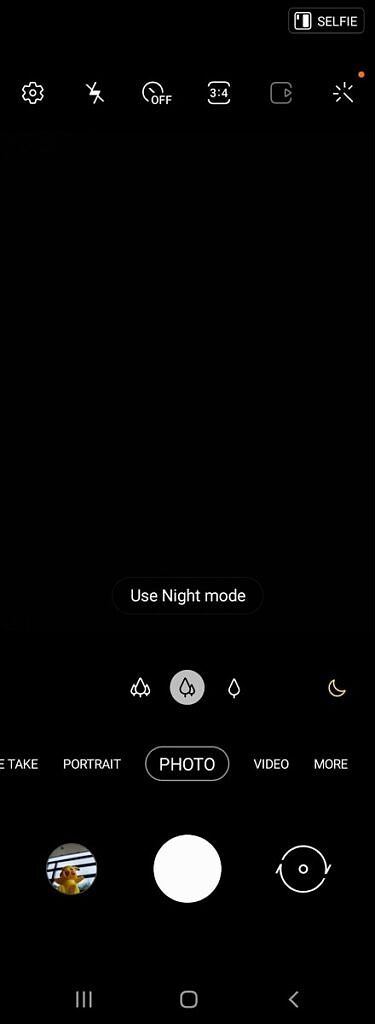
Locate an element on the screen. The width and height of the screenshot is (375, 1024). orange led is located at coordinates (360, 74).